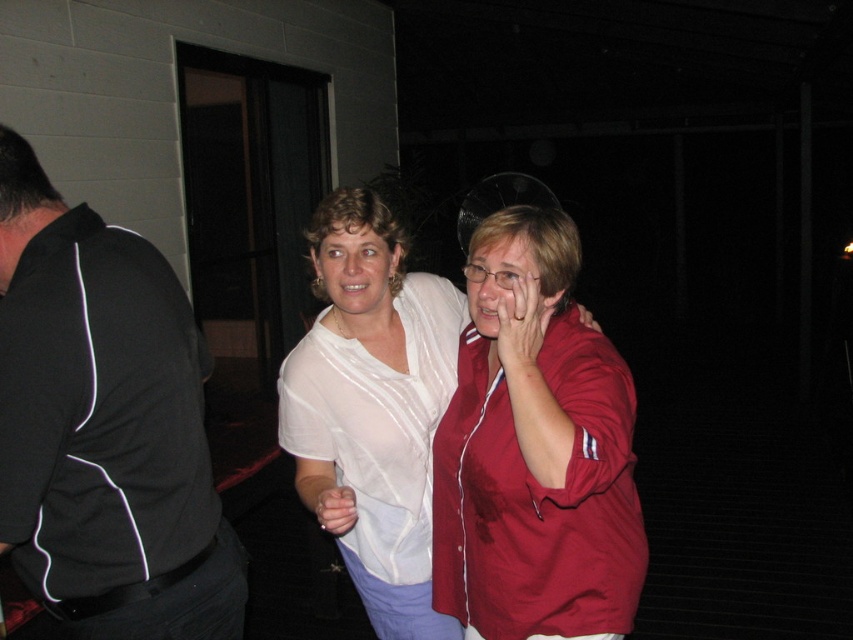
You are a photographer trying to capture the interaction between the two women in the image. Which object, the matte white hand at center or the matte white blouse at center, is positioned farther away from the camera?

The matte white hand at center is behind the matte white blouse at center, so the matte white hand at center is farther away from the camera.

In the scene shown: You are at an indoor event and want to move from your current position to the exit located at point (509, 307). There is an obstacle at point (355, 547). Will you have to go around the obstacle to reach the exit?

Point (355, 547) is behind point (509, 307), so the obstacle at point (355, 547) is behind the exit. Therefore, you can go straight to the exit at point (509, 307) without needing to go around the obstacle.

You are a photographer at the event and want to take a photo of both the matte white blouse at center and the matte red shirt at center. Which one should you focus on first to ensure it appears sharp in the photo?

The matte white blouse at center is further to the viewer than the matte red shirt at center, so you should focus on the matte white blouse at center first to ensure it appears sharp before the matte red shirt at center.